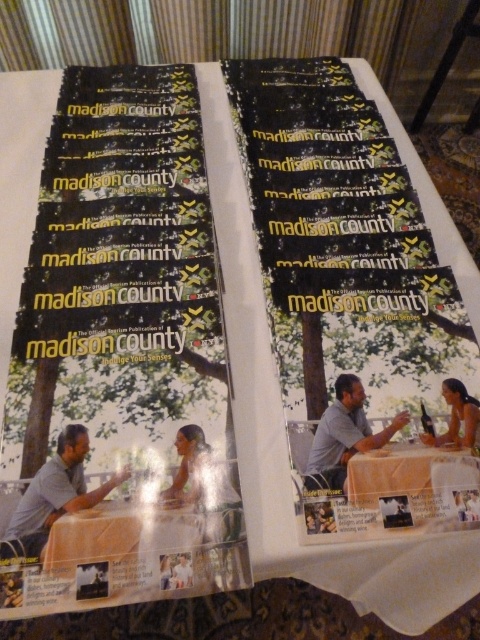
The width and height of the screenshot is (480, 640). Describe the element at coordinates (411, 490) in the screenshot. I see `white plastic table at center` at that location.

What do you see at coordinates (411, 490) in the screenshot?
I see `white plastic table at center` at bounding box center [411, 490].

Where is `white plastic table at center`? Image resolution: width=480 pixels, height=640 pixels. white plastic table at center is located at coordinates (411, 490).

Is point (36, 502) more distant than point (184, 582)?

Yes, it is behind point (184, 582).

Is matte gray shirt at center bigger than smooth skin person at center?

Correct, matte gray shirt at center is larger in size than smooth skin person at center.

Does point (83, 456) come closer to viewer compared to point (186, 570)?

No, (83, 456) is further to viewer.

Locate an element on the screen. Image resolution: width=480 pixels, height=640 pixels. matte gray shirt at center is located at coordinates (55, 493).

Which is behind, point (347, 428) or point (450, 416)?

The point (450, 416) is behind.

Between gray fabric tablecloth at center and matte black magazine at center, which one appears on the right side from the viewer's perspective?

Positioned to the right is matte black magazine at center.

Is point (317, 483) positioned in front of point (464, 404)?

Yes.

The width and height of the screenshot is (480, 640). In order to click on gray fabric tablecloth at center in this screenshot , I will do `click(344, 435)`.